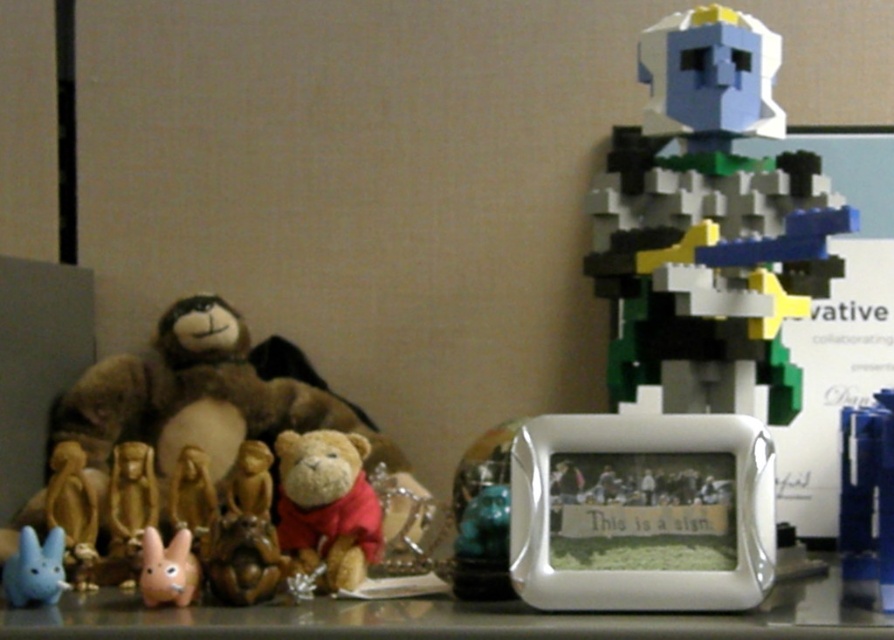
Is point (859, 536) farther from camera compared to point (196, 593)?

Yes, point (859, 536) is behind point (196, 593).

Is blue plastic pen at right positioned before pink matte rabbit at lower left?

Yes, it is in front of pink matte rabbit at lower left.

Identify the location of blue plastic pen at right. (867, 499).

Between multicolored plastic toy at upper right and shiny metallic table at center, which one is positioned lower?

shiny metallic table at center is below.

Find the location of `multicolored plastic toy at upper right`. multicolored plastic toy at upper right is located at coordinates (x=709, y=216).

The image size is (894, 640). What are the coordinates of `multicolored plastic toy at upper right` in the screenshot? It's located at (709, 216).

Who is taller, multicolored plastic toy at upper right or gold metallic statue at lower left?

multicolored plastic toy at upper right is taller.

Measure the distance between point (692, 316) and camera.

37.98 inches

The width and height of the screenshot is (894, 640). I want to click on multicolored plastic toy at upper right, so click(709, 216).